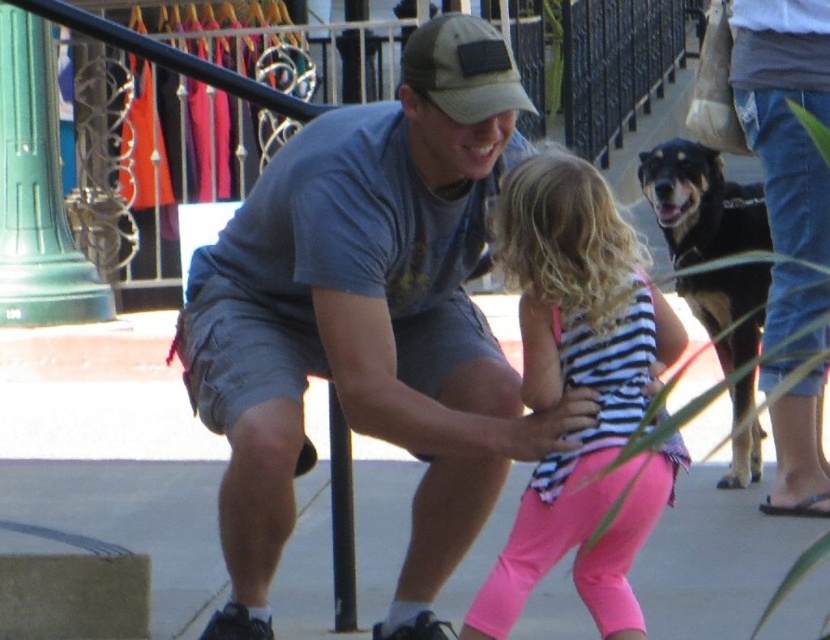
Based on the photo, between denim jeans at right and camouflage fabric baseball cap at center, which one has less height?

Standing shorter between the two is camouflage fabric baseball cap at center.

Who is higher up, denim jeans at right or camouflage fabric baseball cap at center?

camouflage fabric baseball cap at center is higher up.

Does point (821, 336) come closer to viewer compared to point (510, 74)?

No, (821, 336) is behind (510, 74).

At what (x,y) coordinates should I click in order to perform the action: click on denim jeans at right. Please return your answer as a coordinate pair (x, y). The image size is (830, 640). Looking at the image, I should click on 785,115.

Who is higher up, striped fabric shirt at center or denim jeans at right?

denim jeans at right is above.

Is striped fabric shirt at center closer to camera compared to denim jeans at right?

Yes, striped fabric shirt at center is in front of denim jeans at right.

Between point (558, 337) and point (753, 76), which one is positioned in front?

Point (558, 337) is in front.

At what (x,y) coordinates should I click in order to perform the action: click on striped fabric shirt at center. Please return your answer as a coordinate pair (x, y). The image size is (830, 640). Looking at the image, I should click on point(579,387).

Which of these two, black fur dog at right or camouflage fabric baseball cap at center, stands shorter?

Standing shorter between the two is camouflage fabric baseball cap at center.

At what (x,y) coordinates should I click in order to perform the action: click on black fur dog at right. Please return your answer as a coordinate pair (x, y). The width and height of the screenshot is (830, 640). Looking at the image, I should click on (701, 204).

Does point (706, 323) lie in front of point (457, 52)?

That is False.

The height and width of the screenshot is (640, 830). I want to click on black fur dog at right, so click(701, 204).